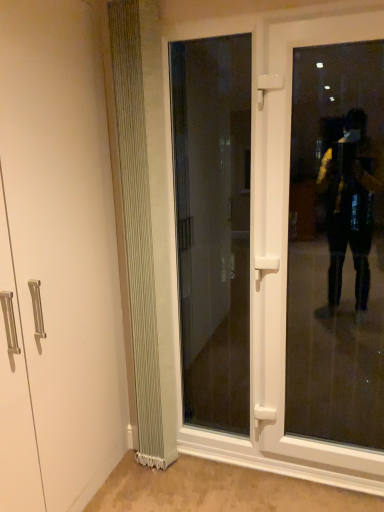
Question: Can you confirm if transparent glass door at center, which appears as the 1th door when viewed from the left, is taller than transparent glass door at right?

Choices:
 (A) yes
 (B) no

Answer: (B)

Question: From a real-world perspective, is transparent glass door at center, which appears as the 1th door when viewed from the left, positioned under transparent glass door at right based on gravity?

Choices:
 (A) yes
 (B) no

Answer: (B)

Question: Does transparent glass door at center, the 2th door positioned from the right, have a lesser width compared to transparent glass door at right?

Choices:
 (A) yes
 (B) no

Answer: (A)

Question: Can you confirm if transparent glass door at center, the 2th door positioned from the right, is positioned to the left of transparent glass door at right?

Choices:
 (A) yes
 (B) no

Answer: (A)

Question: Is transparent glass door at center, the 2th door positioned from the right, located outside transparent glass door at right?

Choices:
 (A) yes
 (B) no

Answer: (A)

Question: Relative to transparent glass door at right, is transparent glass door at center, the 2th door positioned from the right, in front or behind?

Choices:
 (A) behind
 (B) front

Answer: (A)

Question: From a real-world perspective, relative to transparent glass door at right, is transparent glass door at center, which appears as the 1th door when viewed from the left, vertically above or below?

Choices:
 (A) above
 (B) below

Answer: (A)

Question: Does point (196, 82) appear closer or farther from the camera than point (367, 103)?

Choices:
 (A) closer
 (B) farther

Answer: (B)

Question: Is transparent glass door at center, the 2th door positioned from the right, taller or shorter than transparent glass door at right?

Choices:
 (A) short
 (B) tall

Answer: (A)

Question: From the image's perspective, is transparent glass door at right located above or below transparent glass door at center, the 2th door positioned from the right?

Choices:
 (A) above
 (B) below

Answer: (B)

Question: In terms of height, does transparent glass door at right look taller or shorter compared to transparent glass door at center, the 2th door positioned from the right?

Choices:
 (A) short
 (B) tall

Answer: (B)

Question: In terms of size, does transparent glass door at right appear bigger or smaller than transparent glass door at center, which appears as the 1th door when viewed from the left?

Choices:
 (A) big
 (B) small

Answer: (A)

Question: Is transparent glass door at right inside or outside of transparent glass door at center, the 2th door positioned from the right?

Choices:
 (A) inside
 (B) outside

Answer: (B)

Question: From their relative heights in the image, would you say transparent glass door at center, the 2th door positioned from the right, is taller or shorter than white ribbed radiator at left?

Choices:
 (A) short
 (B) tall

Answer: (A)

Question: Considering the positions of transparent glass door at center, which appears as the 1th door when viewed from the left, and white ribbed radiator at left in the image, is transparent glass door at center, which appears as the 1th door when viewed from the left, wider or thinner than white ribbed radiator at left?

Choices:
 (A) thin
 (B) wide

Answer: (A)